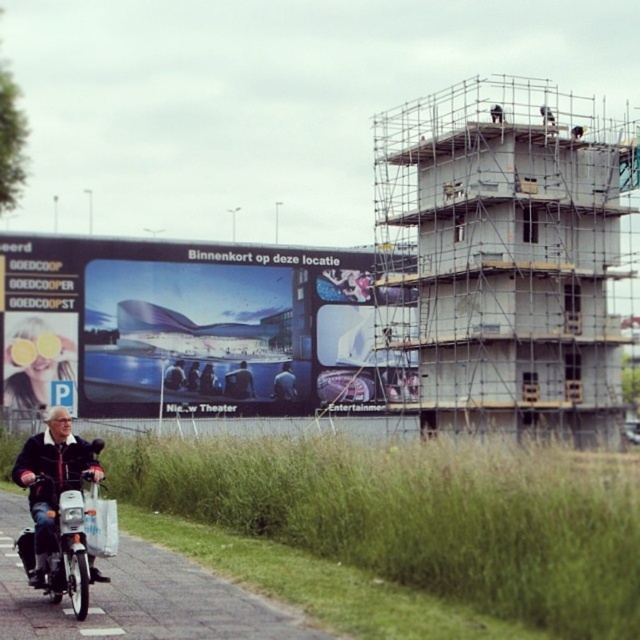
Can you confirm if matte black jacket at lower left is bigger than blue fabric jacket at center?

Indeed, matte black jacket at lower left has a larger size compared to blue fabric jacket at center.

The width and height of the screenshot is (640, 640). I want to click on matte black jacket at lower left, so click(x=51, y=477).

Consider the image. Is matte glass billboard at center behind matte black jacket at lower left?

That is True.

Which is more to the left, matte glass billboard at center or matte black jacket at lower left?

matte black jacket at lower left is more to the left.

You are a GUI agent. You are given a task and a screenshot of the screen. Output one action in this format:
    pyautogui.click(x=<x>, y=<y>)
    Task: Click on the matte glass billboard at center
    This screenshot has width=640, height=640.
    Given the screenshot: What is the action you would take?
    click(x=193, y=323)

Locate an element on the screen. The height and width of the screenshot is (640, 640). matte glass billboard at center is located at coordinates (193, 323).

Can you confirm if matte glass billboard at center is shorter than blue fabric jacket at center?

In fact, matte glass billboard at center may be taller than blue fabric jacket at center.

Does point (161, 273) lie behind point (241, 378)?

No.

Find the location of a particular element. matte glass billboard at center is located at coordinates (193, 323).

You are a GUI agent. You are given a task and a screenshot of the screen. Output one action in this format:
    pyautogui.click(x=<x>, y=<y>)
    Task: Click on the matte glass billboard at center
    Image resolution: width=640 pixels, height=640 pixels.
    Given the screenshot: What is the action you would take?
    pyautogui.click(x=193, y=323)